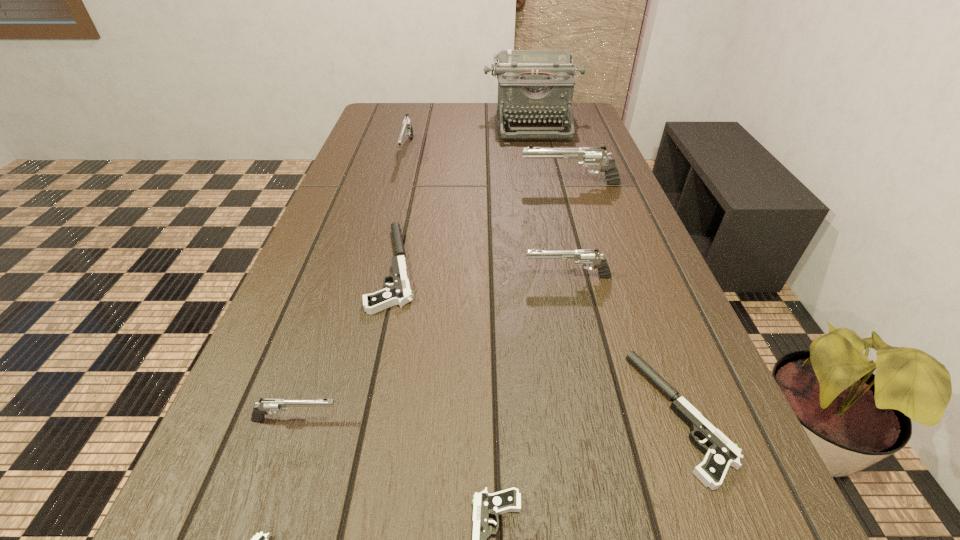
Where is `gray typewriter`? The image size is (960, 540). gray typewriter is located at coordinates (534, 85).

Image resolution: width=960 pixels, height=540 pixels. Find the location of `typewriter`. typewriter is located at coordinates (534, 85).

Where is `the second farthest silver pistol`? Image resolution: width=960 pixels, height=540 pixels. the second farthest silver pistol is located at coordinates (586, 156).

Locate an element on the screen. The width and height of the screenshot is (960, 540). the biggest silver pistol is located at coordinates (586, 156).

You are a GUI agent. You are given a task and a screenshot of the screen. Output one action in this format:
    pyautogui.click(x=<x>, y=<y>)
    Task: Click on the farthest silver pistol
    The width and height of the screenshot is (960, 540).
    Given the screenshot: What is the action you would take?
    pyautogui.click(x=407, y=129)

Where is `the third smallest silver pistol`? Image resolution: width=960 pixels, height=540 pixels. the third smallest silver pistol is located at coordinates (407, 129).

The image size is (960, 540). In order to click on the third tallest pistol in this screenshot , I will do `click(582, 257)`.

Locate an element on the screen. the fourth tallest object is located at coordinates (582, 257).

I want to click on the smallest silver pistol, so click(263, 408).

At what (x,y) coordinates should I click in order to perform the action: click on the nearest silver pistol. Please return your answer as a coordinate pair (x, y). Looking at the image, I should click on (263, 408).